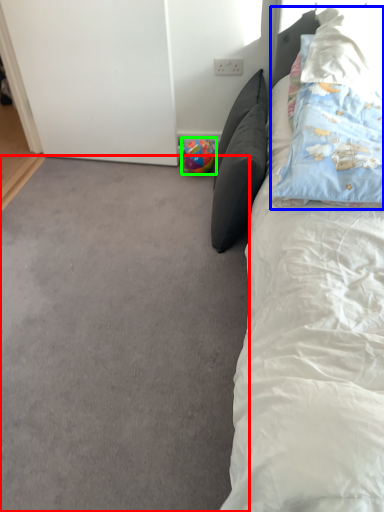
Question: Estimate the real-world distances between objects in this image. Which object is closer to plain (highlighted by a red box), pillow (highlighted by a blue box) or toy (highlighted by a green box)?

Choices:
 (A) pillow
 (B) toy

Answer: (A)